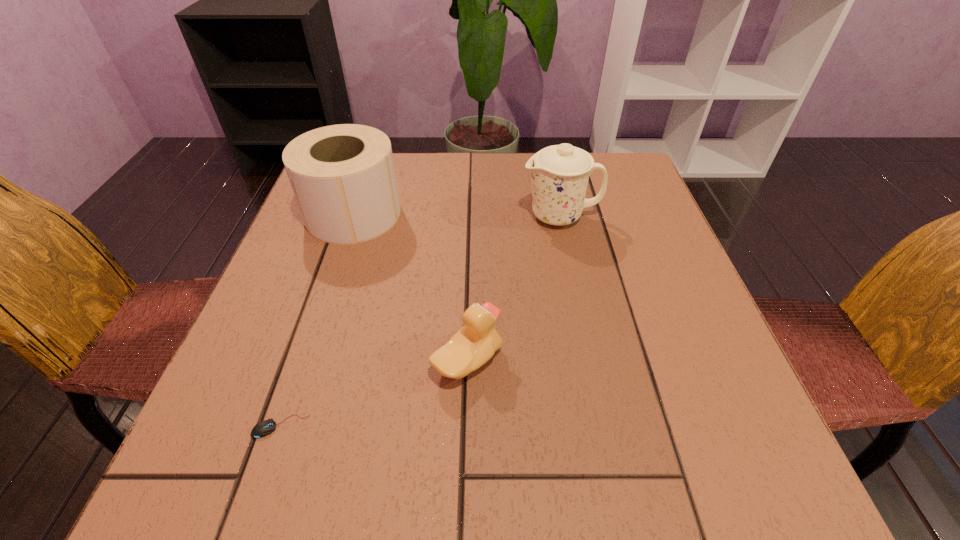
Locate an element on the screen. The width and height of the screenshot is (960, 540). blank space located at the beak of the second shortest object is located at coordinates (718, 361).

Find the location of a particular element. vacant space located 0.340m on the back of the mouse is located at coordinates (336, 262).

Identify the location of chinaware present at the far edge. The height and width of the screenshot is (540, 960). (560, 173).

Locate an element on the screen. This screenshot has height=540, width=960. toilet tissue located at the far edge is located at coordinates (343, 177).

Find the location of a particular element. This screenshot has width=960, height=540. object located in the near edge section of the desktop is located at coordinates (264, 428).

At what (x,y) coordinates should I click in order to perform the action: click on toilet tissue at the left edge. Please return your answer as a coordinate pair (x, y). Looking at the image, I should click on (343, 177).

Find the location of a particular element. The image size is (960, 540). mouse that is at the left edge is located at coordinates (264, 428).

Identify the location of object that is at the right edge. (560, 173).

Identify the location of object present at the far left corner. (343, 177).

You are a GUI agent. You are given a task and a screenshot of the screen. Output one action in this format:
    pyautogui.click(x=<x>, y=<y>)
    Task: Click on the object that is at the near left corner
    This screenshot has height=540, width=960.
    Given the screenshot: What is the action you would take?
    pyautogui.click(x=264, y=428)